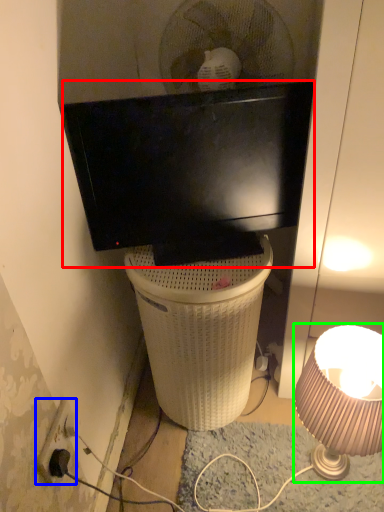
Question: Which object is positioned closest to television (highlighted by a red box)? Select from power outlet (highlighted by a blue box) and lamp (highlighted by a green box).

Choices:
 (A) power outlet
 (B) lamp

Answer: (B)